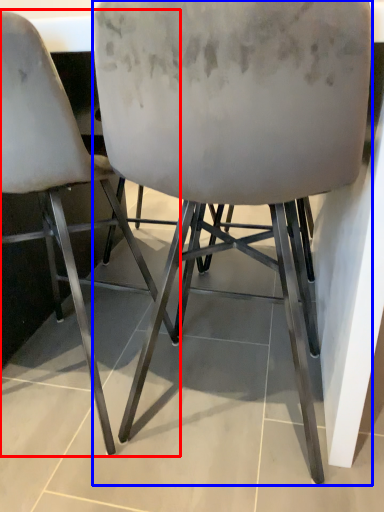
Question: Which point is closer to the camera, chair (highlighted by a red box) or chair (highlighted by a blue box)?

Choices:
 (A) chair
 (B) chair

Answer: (B)